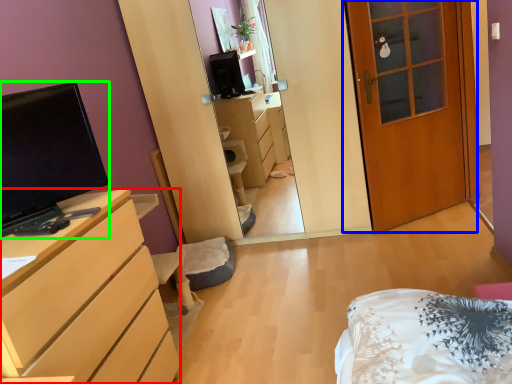
Question: Estimate the real-world distances between objects in this image. Which object is closer to cabinetry (highlighted by a red box), door (highlighted by a blue box) or television (highlighted by a green box)?

Choices:
 (A) door
 (B) television

Answer: (B)